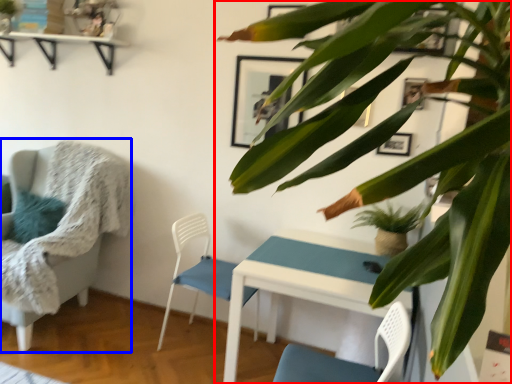
Question: Which of the following is the closest to the observer, houseplant (highlighted by a red box) or chair (highlighted by a blue box)?

Choices:
 (A) houseplant
 (B) chair

Answer: (A)